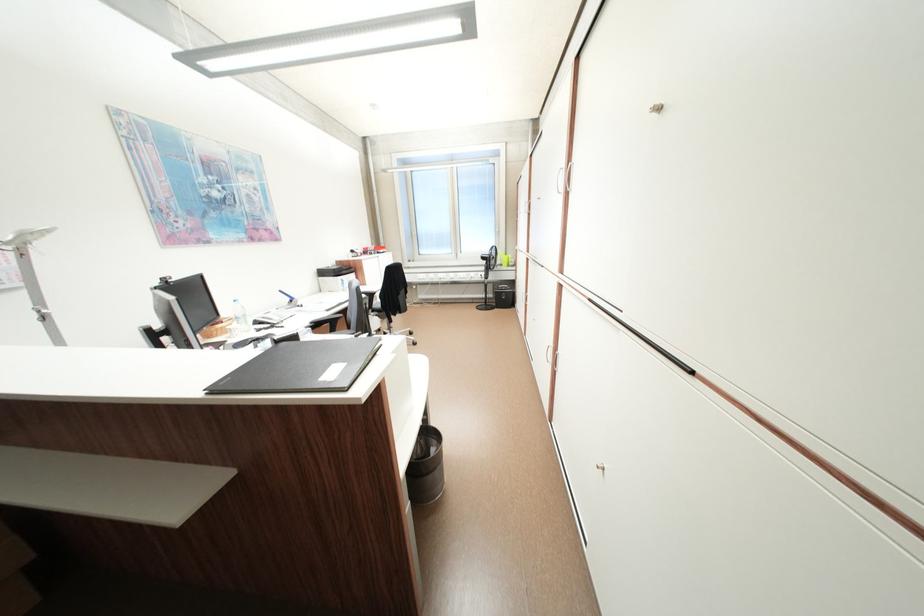
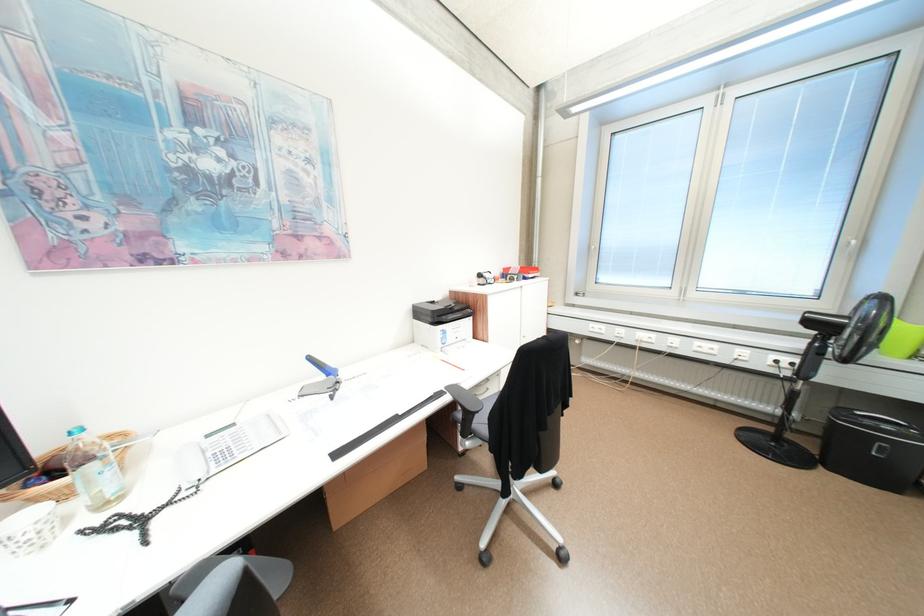
In the second image, find the point that corresponds to the point at 388,248 in the first image.

(538, 269)